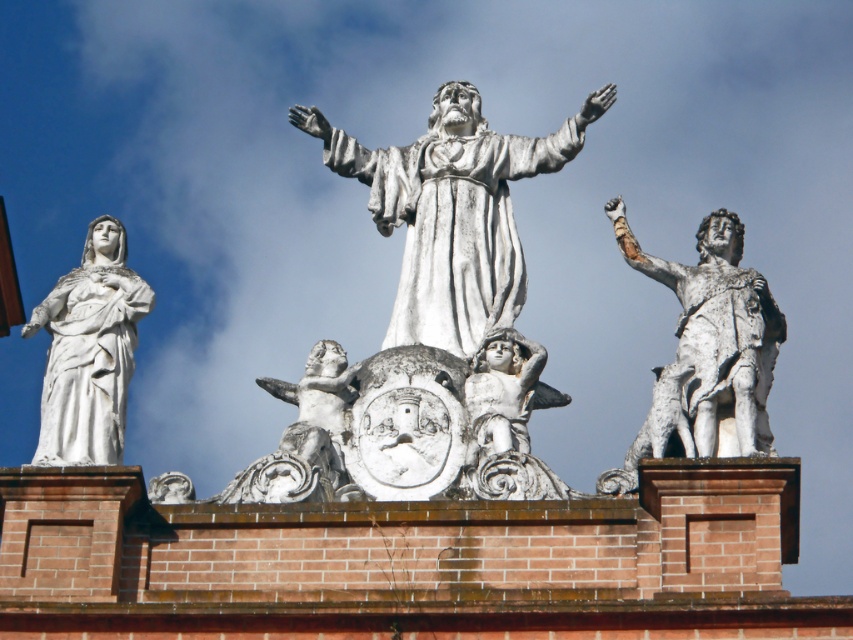
You are an architect designing a new plaza and want to place a new bench in the plaza. The plaza has a central statue flanked by two smaller statues and a coat of arms. The central statue is at point (451, 211). You want to place the bench so that it is equidistant from the central statue and the two smaller statues. Where should you place the bench?

The bench should be placed at the point equidistant from the central statue at point (451, 211) and the two smaller statues. However, without specific coordinates for the smaller statues, an exact placement cannot be determined.

You are an architect designing a new plaza and need to ensure the silver metallic warrior at right is visible from the main entrance, which is 70 meters away. Based on the image, will the warrior be visible from there?

The silver metallic warrior at right is 69.20 meters away from camera, so it will be visible from the main entrance at 70 meters since the distance is slightly further but within visibility range.